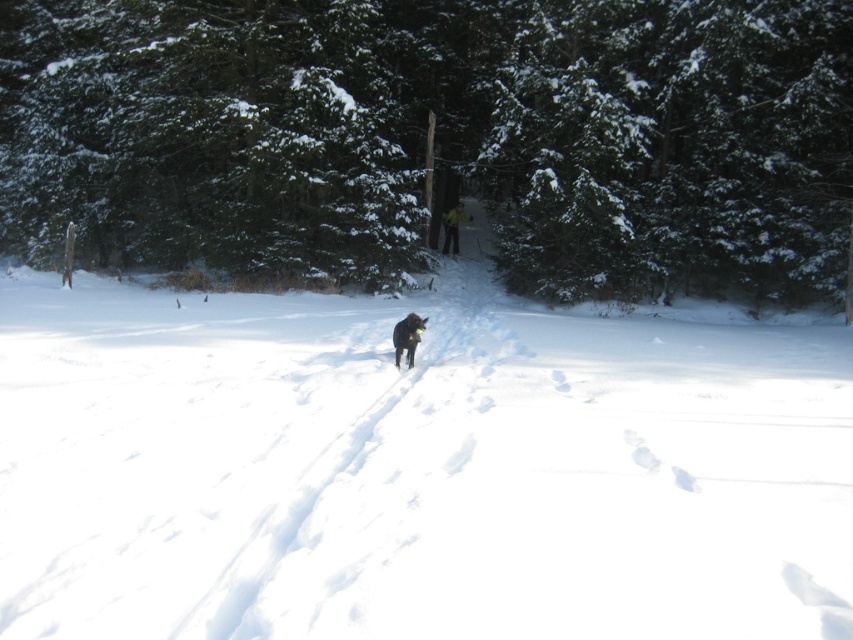
Consider the image. You are a hiker in the winter forest. You see a black fur dog at center and a yellow fabric skier at center. Which object is taller?

The black fur dog at center is much taller than the yellow fabric skier at center.

You are standing at the edge of the snowy forest and see both the black fur dog at center and the yellow fabric skier at center. If you want to reach the closest object first, which one should you head towards?

The black fur dog at center is 60.50 feet away from the yellow fabric skier at center. Since you want to reach the closest object first, you should head towards whichever is nearer. However, the description only provides the distance between them, not their individual distances from your position. Without knowing your exact location relative to both objects, it is impossible to determine which is closer to you.